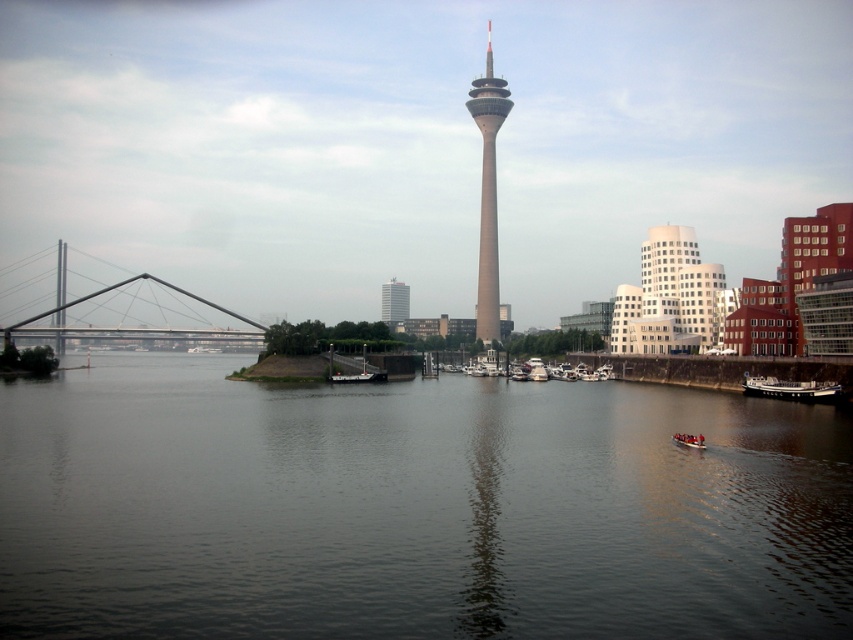
You are a tourist standing on the riverbank and want to take a photo of both the white glossy boats at center and the light gray concrete tower at center. Given that your camera has a maximum zoom range of 100 meters, will you be able to capture both objects in the same frame without moving closer?

The white glossy boats at center is 108.80 meters away from the light gray concrete tower at center. Since your camera can only zoom up to 100 meters, the distance between them exceeds the camera range. Therefore, you won

You are standing at the waterfront and looking at the Rheinturm tower. There are two points marked in the image. The first point is at coordinates point [747,394] and the second point is at point [338,380]. Which of these two points is closer to you?

Point [747,394] is closer to the camera than point [338,380].